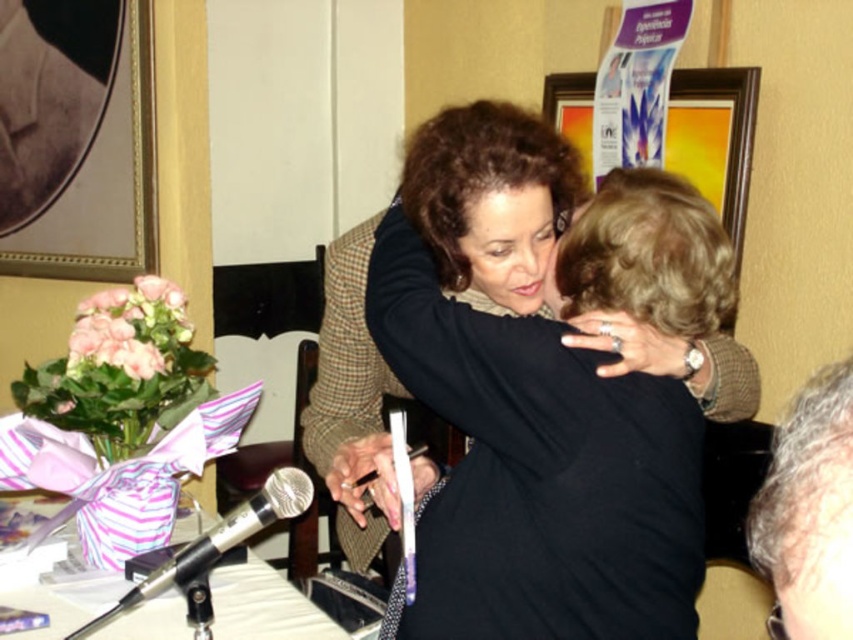
Looking at this image, what are the coordinates of the black matte shirt at center?

The black matte shirt at center is located at point (534, 461).

You are a photographer positioned at the back of the room. You want to take a photo of the black matte shirt at center and the wooden picture frame at upper center in the same shot. The camera you are using has a maximum focus range of 1.2 meters. Will both objects be in focus?

The distance between the black matte shirt at center and the wooden picture frame at upper center is 1.23 meters. Since the camera can only focus up to 1.2 meters, the objects are slightly out of the camera range. Therefore, both objects might not be in focus simultaneously.